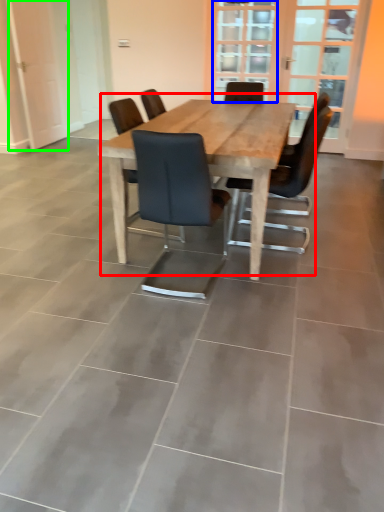
Question: Considering the real-world distances, which object is closest to kitchen & dining room table (highlighted by a red box)? glass door (highlighted by a blue box) or screen door (highlighted by a green box).

Choices:
 (A) glass door
 (B) screen door

Answer: (B)